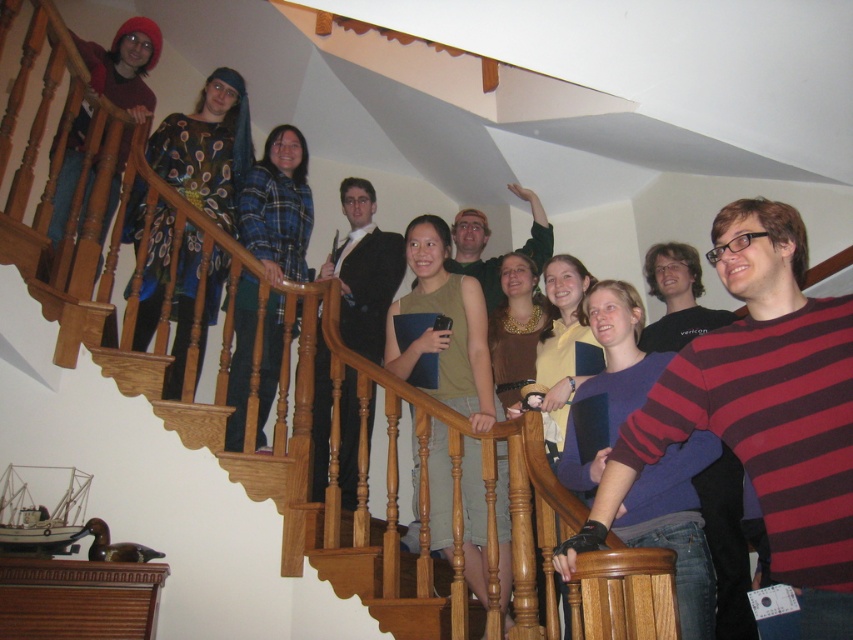
Is point (704, 420) less distant than point (192, 237)?

Yes, point (704, 420) is closer to viewer.

Describe the element at coordinates (762, 410) in the screenshot. I see `striped sweater at center` at that location.

Identify the location of striped sweater at center. The image size is (853, 640). (762, 410).

Can you confirm if black suit jacket at center is thinner than matte black hoodie at upper left?

Answer: Yes.

Does black suit jacket at center have a larger size compared to matte black hoodie at upper left?

Yes, black suit jacket at center is bigger than matte black hoodie at upper left.

Is point (357, 451) more distant than point (155, 38)?

That is False.

Locate an element on the screen. This screenshot has height=640, width=853. black suit jacket at center is located at coordinates (364, 269).

Is point (479, 467) more distant than point (350, 396)?

No.

Find the location of `matte green tank top at center`. matte green tank top at center is located at coordinates (445, 330).